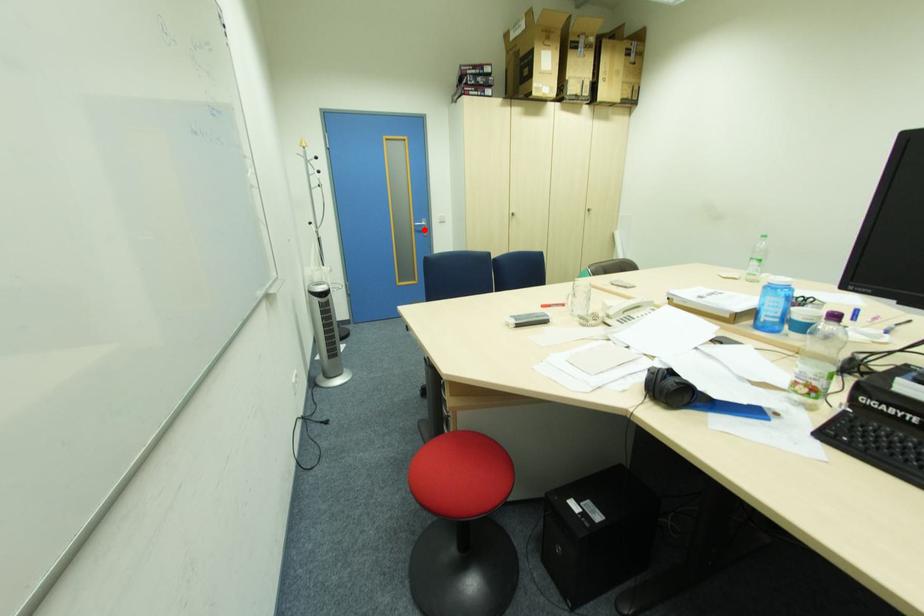
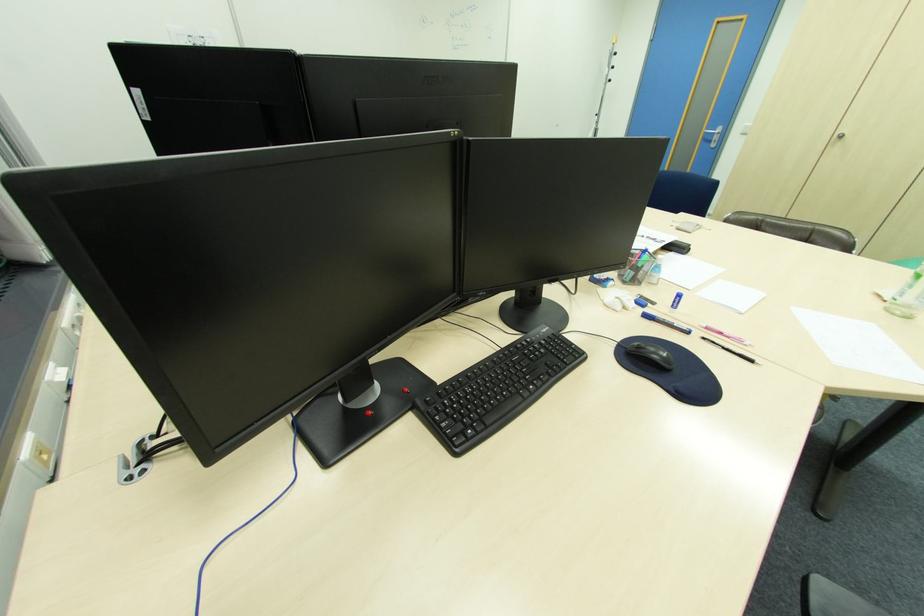
Where in the second image is the point corresponding to the highlighted location from the first image?

(713, 139)